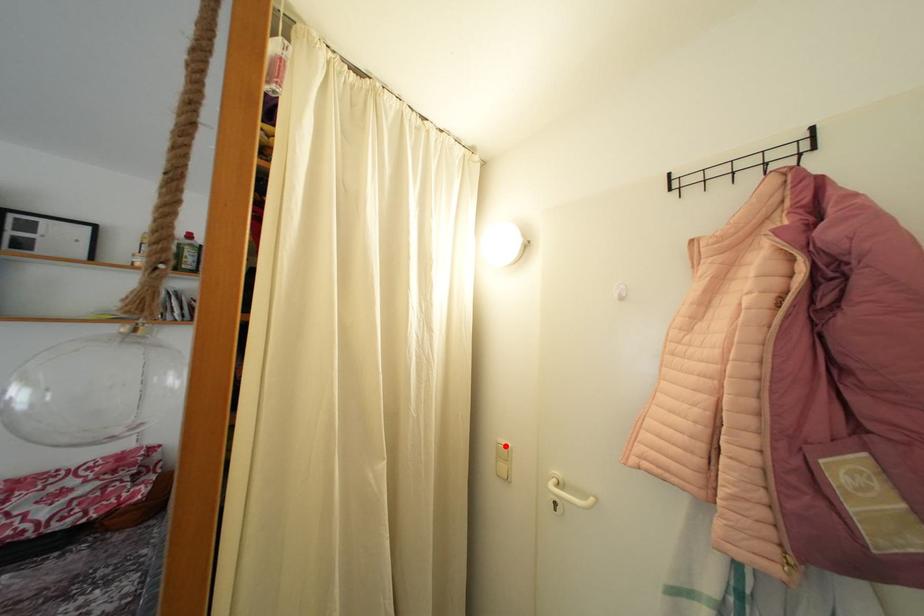
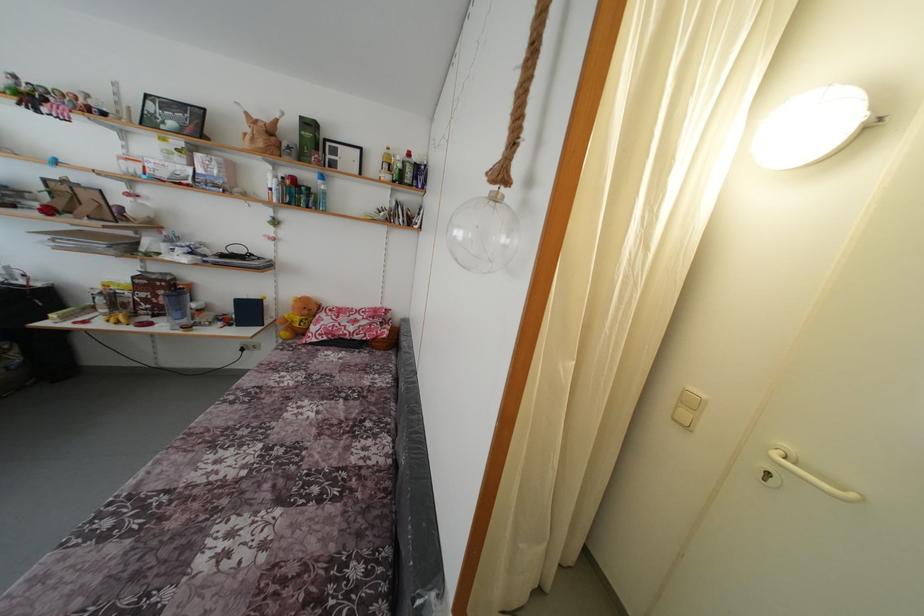
Question: A red point is marked in image1. In image2, is the corresponding 3D point closer to the camera or farther? Reply with the corresponding letter.

Choices:
 (A) The corresponding 3D point is closer.
 (B) The corresponding 3D point is farther.

Answer: (A)